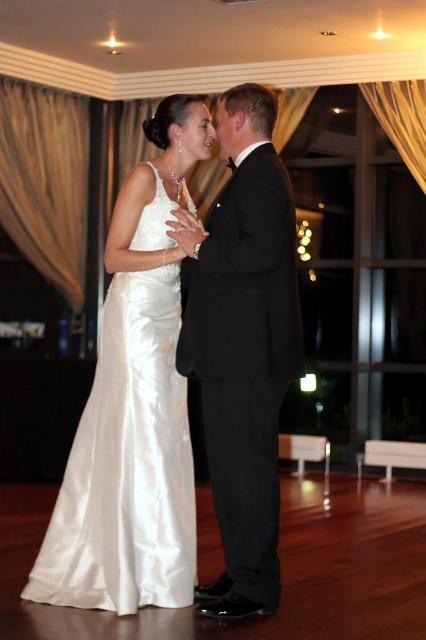
Question: Does black satin suit at center appear over satin/smooth dress at left?

Choices:
 (A) yes
 (B) no

Answer: (A)

Question: Can you confirm if black satin suit at center is thinner than satin/smooth dress at left?

Choices:
 (A) no
 (B) yes

Answer: (B)

Question: Which point is farther to the camera?

Choices:
 (A) (138, 292)
 (B) (291, 225)

Answer: (A)

Question: Does black satin suit at center appear on the left side of satin/smooth dress at left?

Choices:
 (A) yes
 (B) no

Answer: (B)